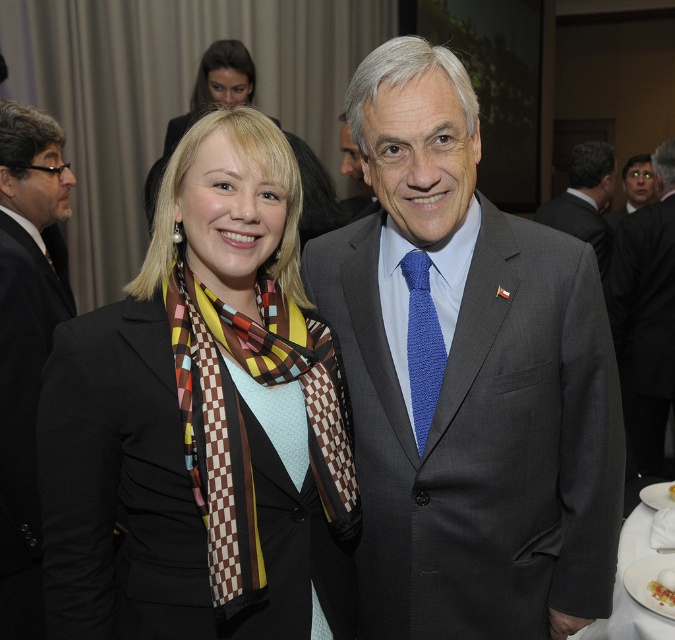
You are a photographer setting up for a formal event. You need to place a small microphone stand exactly halfway between the black suit at left and the man in the dark gray suit. What are the coordinates of the midpoint between them?

The midpoint between the black suit at left and the man in the dark gray suit would be at coordinates calculated by averaging their positions. Since the black suit at left is at point (26, 342), and the man in the dark gray suit is at an unknown position, we cannot provide exact coordinates without additional information.

Based on the photo, you are a photographer setting up for a group photo. You need to ensure there is enough space between the matte black blazer at center and the black suit at left for a microphone stand. The stand requires at least 2 feet of space. Based on the image, is there sufficient space?

The distance between the matte black blazer at center and the black suit at left is 30.46 inches, which is approximately 2.54 feet. Since the microphone stand requires at least 2 feet of space, there is enough room between them.

You are a photographer adjusting the camera settings to ensure both the matte gray suit at center and the blue knitted tie at center are in focus. Given that the depth of field can only accommodate one of them clearly, which object should you prioritize focusing on based on their sizes?

The matte gray suit at center is wider than the blue knitted tie at center, so you should prioritize focusing on the matte gray suit at center to ensure it appears sharp in the photograph.